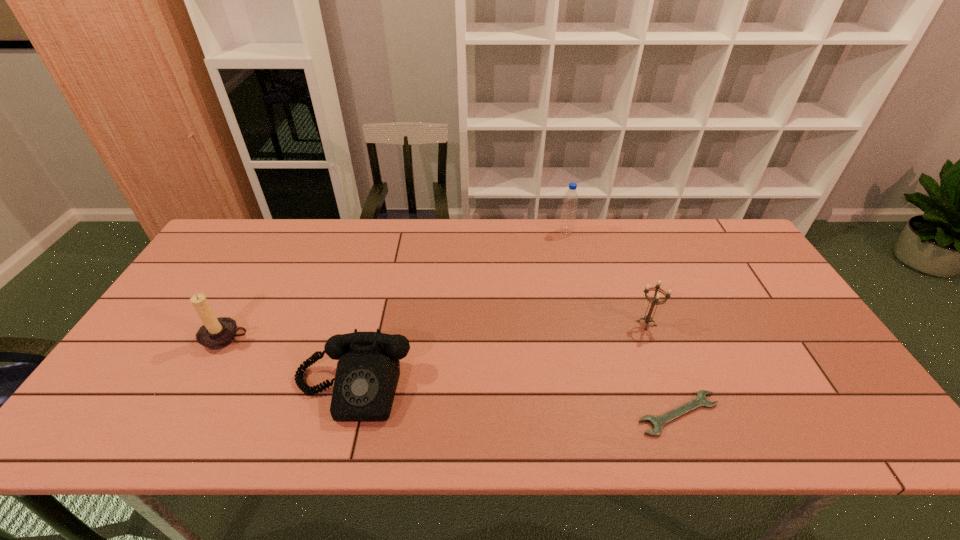
The image size is (960, 540). I want to click on free point located 0.260m on the left of the shortest object, so click(521, 414).

I want to click on object at the far edge, so click(569, 207).

I want to click on telephone situated at the near edge, so click(x=368, y=368).

Locate an element on the screen. The width and height of the screenshot is (960, 540). wrench positioned at the near edge is located at coordinates (658, 422).

I want to click on object situated at the left edge, so click(x=216, y=333).

The width and height of the screenshot is (960, 540). In order to click on vacant space at the far edge of the desktop in this screenshot , I will do `click(476, 227)`.

Identify the location of free space at the near edge of the desktop. The width and height of the screenshot is (960, 540). (232, 432).

Find the location of a particular element. free point at the left edge is located at coordinates (156, 369).

This screenshot has width=960, height=540. In the image, there is a desktop. Identify the location of vacant space at the right edge. [768, 329].

Image resolution: width=960 pixels, height=540 pixels. Identify the location of free space at the far left corner. (254, 237).